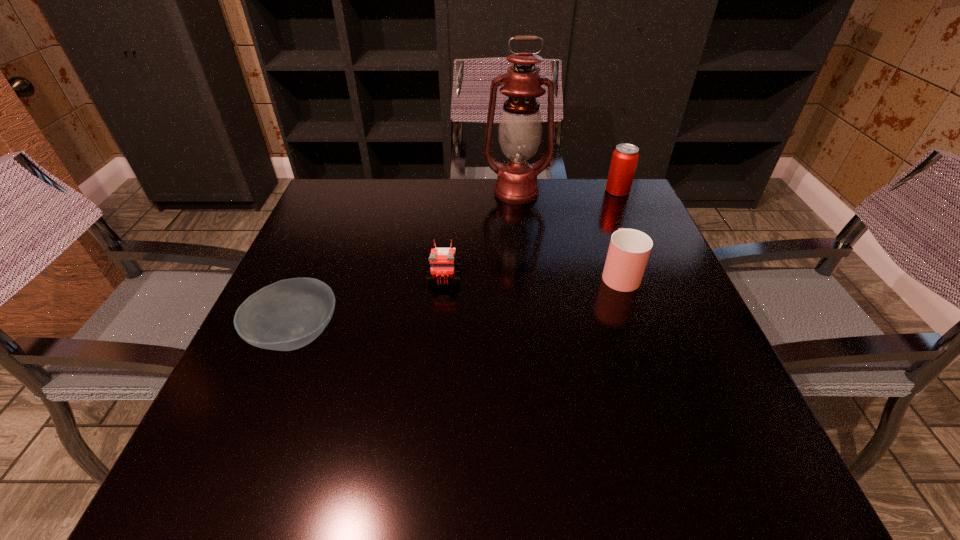
Identify the location of vacant space that satisfies the following two spatial constraints: 1. on the side of the cup with the handle; 2. on the left side of the can. (590, 191).